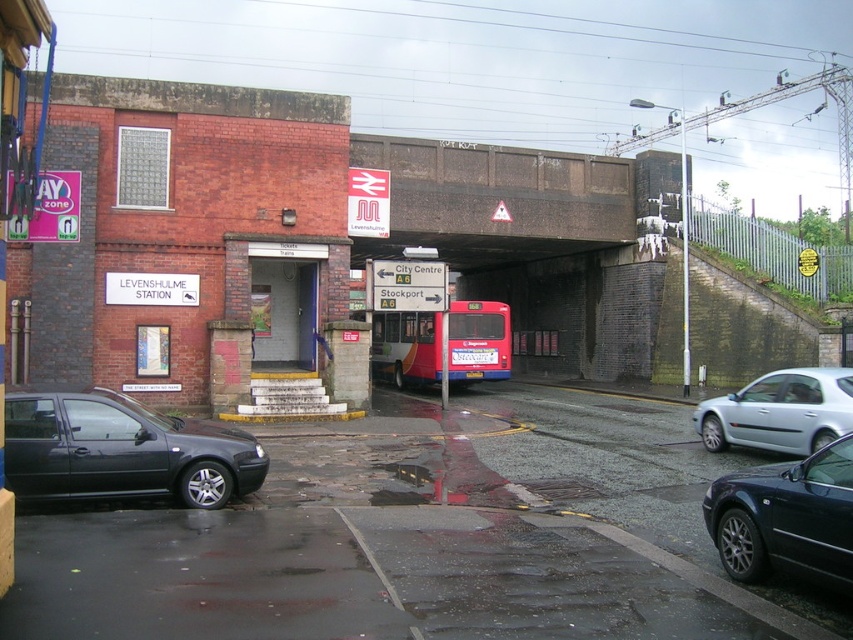
You are a pedestrian standing at the entrance of Levenshulme Station. You need to cross the road to reach the brown concrete bridge at upper center. Is the silver metallic car at right blocking your path?

The brown concrete bridge at upper center is positioned over the silver metallic car at right, meaning the car is underneath the bridge. Therefore, the silver metallic car at right is not blocking your path to the bridge.

You are a pedestrian standing at the entrance of Levenshulme Station. You need to cross the road to reach the A6 route. There are two cars nearby, a shiny black sedan at lower right and a silver metallic car at right. Which car is closer to you?

The shiny black sedan at lower right is closer to you since it is only 5.79 meters away from the silver metallic car at right, but since you are at the entrance, the silver metallic car at right might be farther. Wait, I need to check the description again. The description says the shiny black sedan is 5.79 meters from the silver metallic car. So if you are at the entrance, which is the reference point, the distance between the two cars is 5.79 meters. But the question is which is closer to the pedestrian.

You are a delivery driver who needs to pass under the brown concrete bridge at upper center with your truck that is 3.5 meters tall. The white plastic license plate at center indicates the maximum height allowed. Can you safely pass under the bridge?

The brown concrete bridge at upper center might be wider than white plastic license plate at center, but the maximum height allowed is indicated by the white plastic license plate at center. Without knowing the exact height restriction, it is uncertain if the truck can safely pass under the bridge.